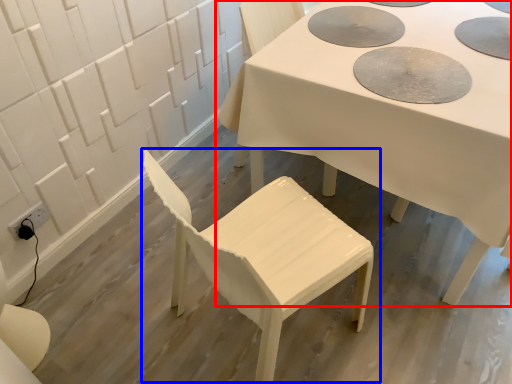
Question: Which of the following is the farthest to the observer, table (highlighted by a red box) or chair (highlighted by a blue box)?

Choices:
 (A) table
 (B) chair

Answer: (A)